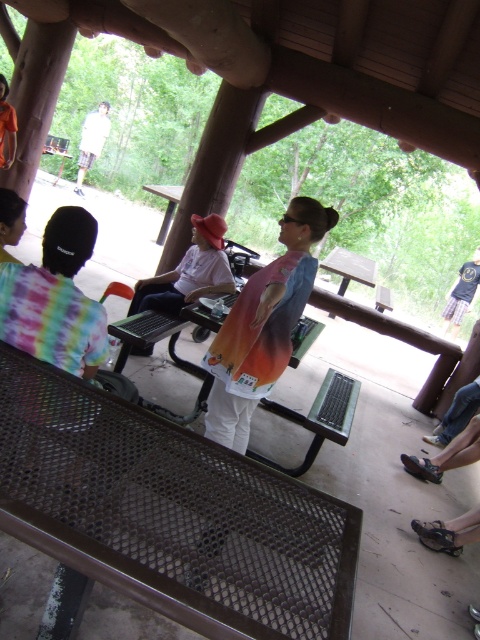
Does brown metal bench at center have a greater width compared to gradient tie-dye shirt at center?

Yes.

Measure the distance between point (55, 493) and camera.

The distance of point (55, 493) from camera is 1.25 meters.

Find the location of a particular element. This screenshot has height=640, width=480. brown metal bench at center is located at coordinates (169, 513).

From the picture: Between brown metal bench at center and brown metal picnic table at center, which one appears on the right side from the viewer's perspective?

brown metal bench at center

Is brown metal bench at center smaller than brown metal picnic table at center?

Indeed, brown metal bench at center has a smaller size compared to brown metal picnic table at center.

Does point (56, 412) come closer to viewer compared to point (166, 230)?

Yes, it is in front of point (166, 230).

I want to click on brown metal bench at center, so click(169, 513).

Based on the photo, which of these two, gradient tie-dye shirt at center or brown metal picnic table at center, stands taller?

Standing taller between the two is gradient tie-dye shirt at center.

You are a GUI agent. You are given a task and a screenshot of the screen. Output one action in this format:
    pyautogui.click(x=<x>, y=<y>)
    Task: Click on the gradient tie-dye shirt at center
    This screenshot has height=640, width=480.
    Given the screenshot: What is the action you would take?
    pyautogui.click(x=263, y=324)